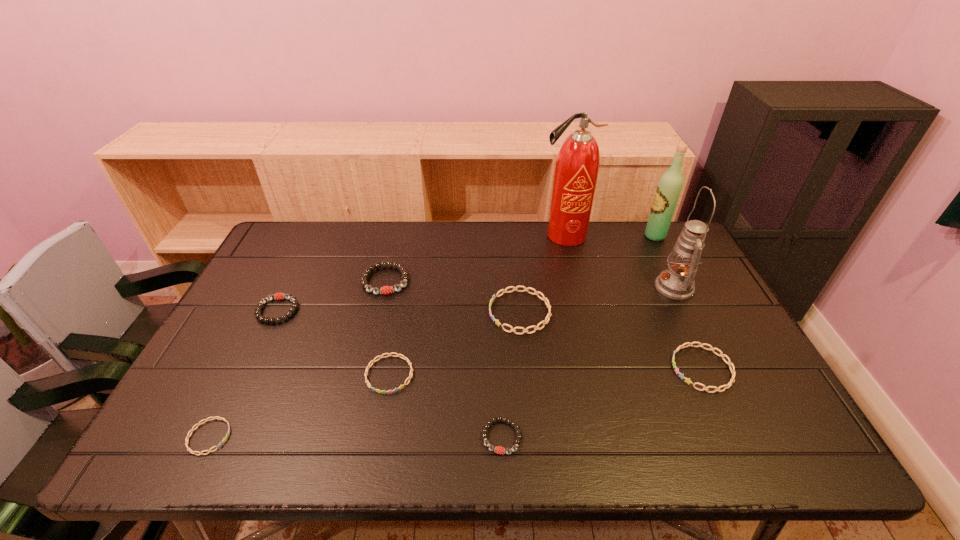
Where is `fire extinguisher`? The image size is (960, 540). fire extinguisher is located at coordinates (577, 166).

In order to click on the tallest object in this screenshot , I will do `click(577, 166)`.

Locate an element on the screen. The image size is (960, 540). white wine bottle is located at coordinates (670, 185).

This screenshot has width=960, height=540. In order to click on oil lamp in this screenshot , I will do `click(677, 282)`.

Where is `the biggest blue bracelet`? The width and height of the screenshot is (960, 540). the biggest blue bracelet is located at coordinates (544, 298).

Where is `the third blue bracelet from left to right`? This screenshot has width=960, height=540. the third blue bracelet from left to right is located at coordinates (544, 298).

Find the location of `the second black bracelet from right to left`. the second black bracelet from right to left is located at coordinates (385, 290).

At what (x,y) coordinates should I click in order to perform the action: click on the rightmost blue bracelet. Please return your answer as a coordinate pair (x, y). This screenshot has width=960, height=540. Looking at the image, I should click on (722, 355).

Locate an element on the screen. the second biggest blue bracelet is located at coordinates (722, 355).

Where is `the second smallest black bracelet`? the second smallest black bracelet is located at coordinates (278, 296).